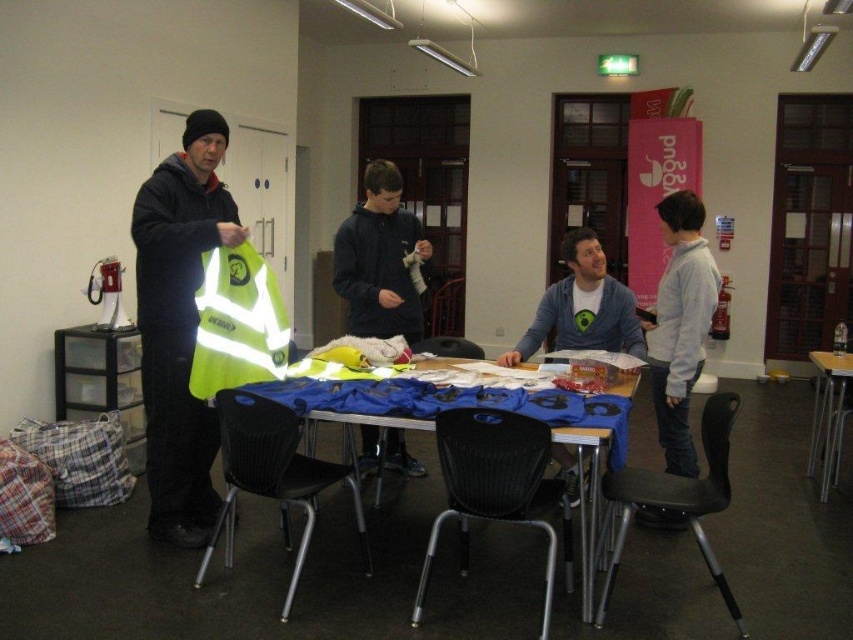
Is blue fabric table at center thinner than black plastic chair at lower center?

No, blue fabric table at center is not thinner than black plastic chair at lower center.

Which is above, blue fabric table at center or black plastic chair at lower center?

blue fabric table at center

Is point (589, 588) behind point (276, 458)?

Yes, it is behind point (276, 458).

Locate an element on the screen. The width and height of the screenshot is (853, 640). blue fabric table at center is located at coordinates (463, 406).

Can you confirm if dark blue hoodie at center is positioned below wooden table at right?

No, dark blue hoodie at center is not below wooden table at right.

Which is more to the right, dark blue hoodie at center or wooden table at right?

wooden table at right is more to the right.

Does point (347, 310) lie behind point (825, 388)?

Yes, point (347, 310) is farther from viewer.

I want to click on dark blue hoodie at center, so click(x=380, y=259).

Locate an element on the screen. The height and width of the screenshot is (640, 853). blue fabric table at center is located at coordinates (463, 406).

You are a GUI agent. You are given a task and a screenshot of the screen. Output one action in this format:
    pyautogui.click(x=<x>, y=<y>)
    Task: Click on the blue fabric table at center
    
    Given the screenshot: What is the action you would take?
    pyautogui.click(x=463, y=406)